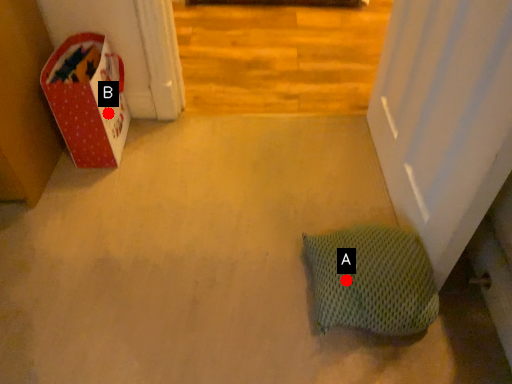
Question: Two points are circled on the image, labeled by A and B beside each circle. Among these points, which one is nearest to the camera?

Choices:
 (A) A is closer
 (B) B is closer

Answer: (A)